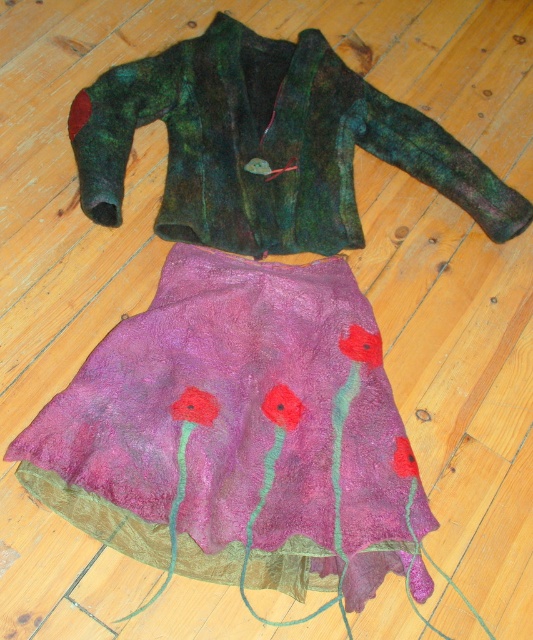
Question: Does green felted jacket at upper center lie behind vibrant red felt flower at center?

Choices:
 (A) yes
 (B) no

Answer: (A)

Question: Can you confirm if purple felt skirt at center is positioned below green felted jacket at upper center?

Choices:
 (A) no
 (B) yes

Answer: (B)

Question: Which of the following is the farthest from the observer?

Choices:
 (A) (358, 342)
 (B) (261, 100)

Answer: (B)

Question: Considering the relative positions of purple felt skirt at center and felted wool flower at center in the image provided, where is purple felt skirt at center located with respect to felted wool flower at center?

Choices:
 (A) below
 (B) above

Answer: (A)

Question: Based on their relative distances, which object is farther from the fluffy felt flower at center?

Choices:
 (A) matte felt flower at center
 (B) vibrant red felt flower at center

Answer: (A)

Question: Which object is positioned closest to the matte felt flower at center?

Choices:
 (A) vibrant red felt flower at center
 (B) fluffy felt flower at center
 (C) green felted jacket at upper center
 (D) purple felt skirt at center

Answer: (A)